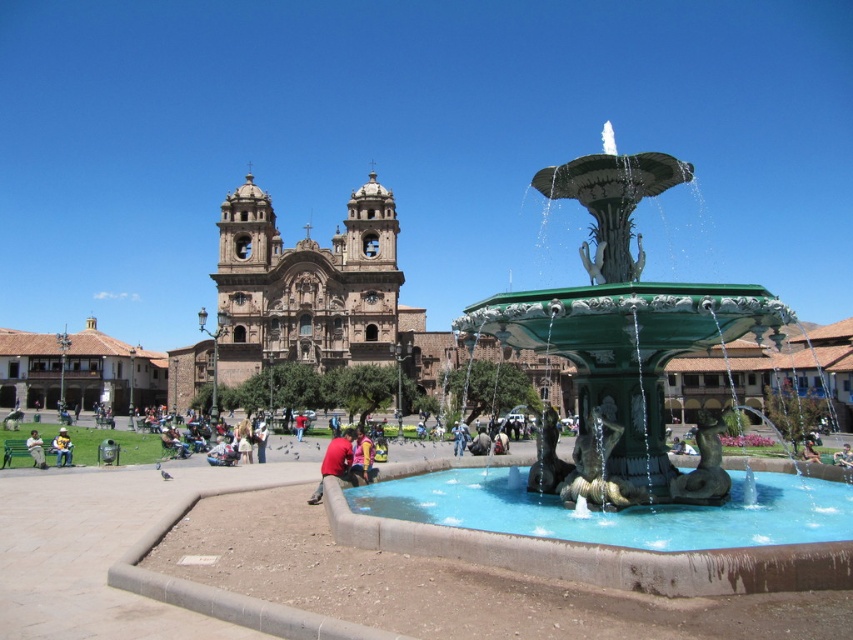
Who is lower down, green stone fountain at center or yellow fabric jacket at lower left?

yellow fabric jacket at lower left

Who is positioned more to the left, green stone fountain at center or yellow fabric jacket at lower left?

yellow fabric jacket at lower left

This screenshot has height=640, width=853. In order to click on green stone fountain at center in this screenshot , I will do `click(622, 444)`.

Can you confirm if green stone fountain at center is positioned to the left of red matte shirt at lower center?

Incorrect, green stone fountain at center is not on the left side of red matte shirt at lower center.

Is green stone fountain at center wider than red matte shirt at lower center?

Correct, the width of green stone fountain at center exceeds that of red matte shirt at lower center.

Based on the photo, who is more forward, [614,429] or [310,496]?

Point [614,429]

The image size is (853, 640). In order to click on green stone fountain at center in this screenshot , I will do `click(622, 444)`.

Does yellow fabric jacket at lower left have a lesser width compared to light brown leather jacket at lower left?

Yes, yellow fabric jacket at lower left is thinner than light brown leather jacket at lower left.

Consider the image. Who is positioned more to the right, yellow fabric jacket at lower left or light brown leather jacket at lower left?

yellow fabric jacket at lower left is more to the right.

What do you see at coordinates (62, 448) in the screenshot? I see `yellow fabric jacket at lower left` at bounding box center [62, 448].

Locate an element on the screen. yellow fabric jacket at lower left is located at coordinates tap(62, 448).